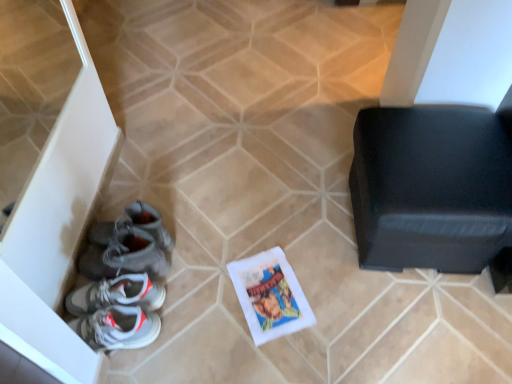
Locate an element on the screen. free point to the right of gray suede sneakers at lower left is located at coordinates (199, 257).